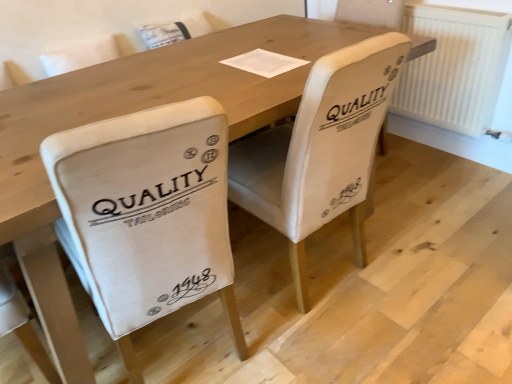
Question: Considering the positions of white paper at center and white textured radiator at right in the image, is white paper at center wider or thinner than white textured radiator at right?

Choices:
 (A) wide
 (B) thin

Answer: (A)

Question: In the image, is white paper at center positioned in front of or behind white textured radiator at right?

Choices:
 (A) front
 (B) behind

Answer: (A)

Question: Considering the real-world distances, which object is closest to the white textured radiator at right?

Choices:
 (A) white fabric chair at center, the 1th chair when ordered from right to left
 (B) white paper at center
 (C) beige fabric chair at center, which appears as the 2th chair when viewed from the right

Answer: (B)

Question: Which object is the closest to the white paper at center?

Choices:
 (A) beige fabric chair at center, acting as the 1th chair starting from the left
 (B) white textured radiator at right
 (C) white fabric chair at center, the 1th chair when ordered from right to left

Answer: (C)